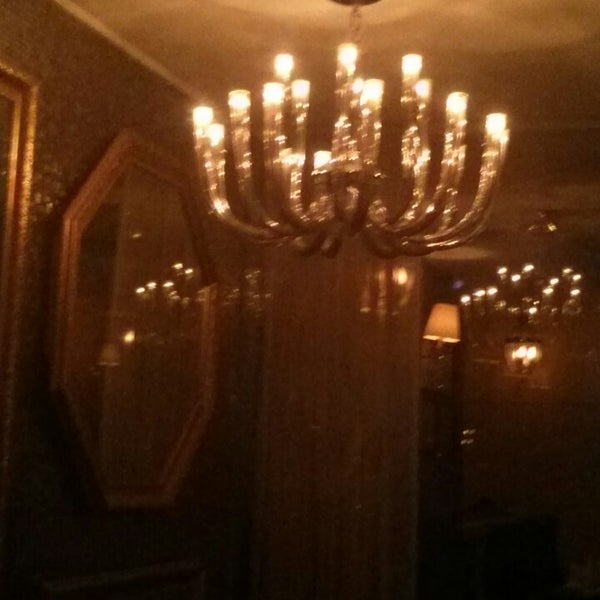
The height and width of the screenshot is (600, 600). In order to click on bottom edge of mirror in this screenshot , I will do `click(131, 499)`.